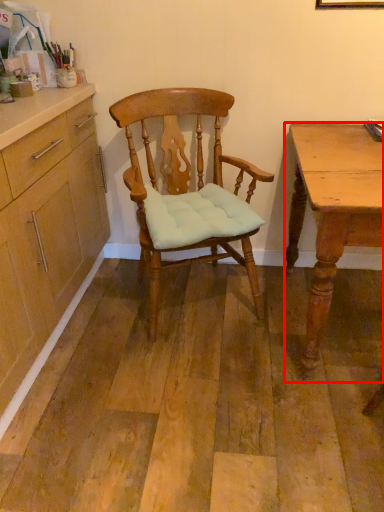
Question: From the image's perspective, what is the correct spatial relationship of desk (annotated by the red box) in relation to chair?

Choices:
 (A) below
 (B) above

Answer: (A)